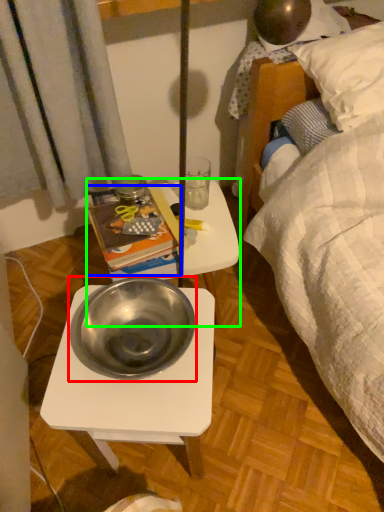
Question: Which is nearer to the bowl (highlighted by a red box)? paperback book (highlighted by a blue box) or table (highlighted by a green box).

Choices:
 (A) paperback book
 (B) table

Answer: (A)